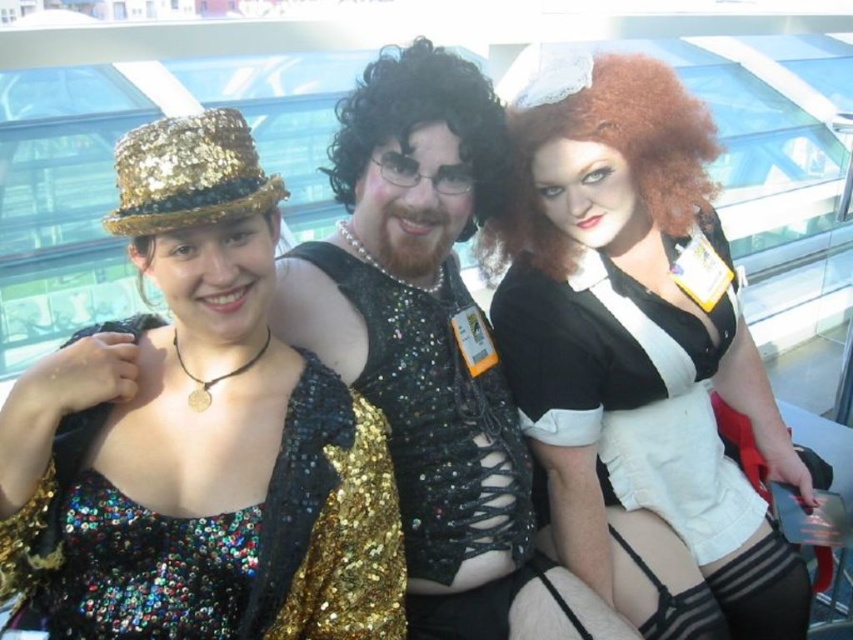
You are a photographer trying to capture a clear shot of both the sequined gold dress at center and the sequined fabric vest at center. Based on their positions, which one is closer to the camera?

The sequined gold dress at center is in front of the sequined fabric vest at center, so it is closer to the camera.

You are a photographer setting up for a group photo. You need to ensure that the white matte dress at center and the curly brown wig at center are both visible in the frame. Given their sizes, which one might require more careful positioning to avoid being obscured?

The white matte dress at center is much taller than the curly brown wig at center, so the dress might need more careful positioning to avoid blocking the wig or being partially out of frame.